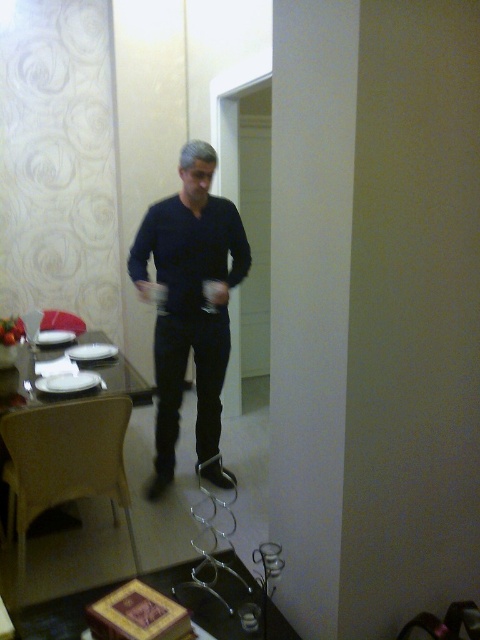
Question: Is dark blue shirt at center to the left of white glossy table at left from the viewer's perspective?

Choices:
 (A) no
 (B) yes

Answer: (A)

Question: Is dark blue shirt at center bigger than white glossy table at left?

Choices:
 (A) yes
 (B) no

Answer: (A)

Question: Is dark blue shirt at center above white glossy table at left?

Choices:
 (A) yes
 (B) no

Answer: (A)

Question: Which point is farther from the camera taking this photo?

Choices:
 (A) (24, 384)
 (B) (170, 260)

Answer: (B)

Question: Which object is closer to the camera taking this photo?

Choices:
 (A) white glossy table at left
 (B) dark blue shirt at center

Answer: (A)